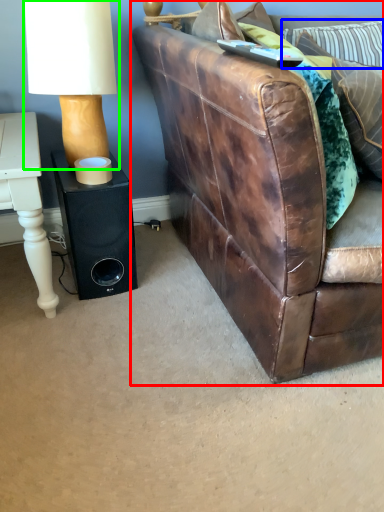
Question: Estimate the real-world distances between objects in this image. Which object is farther from studio couch (highlighted by a red box), pillow (highlighted by a blue box) or table lamp (highlighted by a green box)?

Choices:
 (A) pillow
 (B) table lamp

Answer: (A)